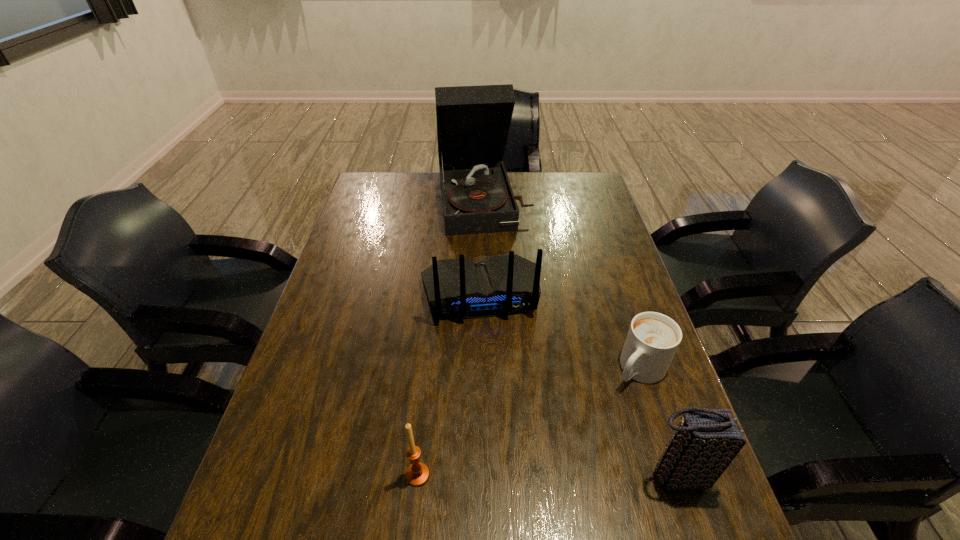
Where is `clutch bag present at the right edge`? The width and height of the screenshot is (960, 540). clutch bag present at the right edge is located at coordinates (705, 442).

Where is `cappuccino that is at the right edge`? cappuccino that is at the right edge is located at coordinates (653, 338).

The height and width of the screenshot is (540, 960). Find the location of `object that is positioned at the near right corner`. object that is positioned at the near right corner is located at coordinates click(705, 442).

Identify the location of free space at the near edge of the desktop. This screenshot has width=960, height=540. (394, 494).

Where is `free region at the left edge of the desktop`? free region at the left edge of the desktop is located at coordinates [302, 347].

In the image, there is a desktop. Identify the location of vacant space at the right edge. (600, 226).

Where is `free spot between the candle_holder and the clutch bag`? Image resolution: width=960 pixels, height=540 pixels. free spot between the candle_holder and the clutch bag is located at coordinates (547, 475).

Where is `empty location between the candle_holder and the clutch bag`? empty location between the candle_holder and the clutch bag is located at coordinates (547, 475).

Identify the location of vacant space that is in between the candle_holder and the clutch bag. The height and width of the screenshot is (540, 960). (547, 475).

Locate an element on the screen. free spot between the router and the clutch bag is located at coordinates (578, 385).